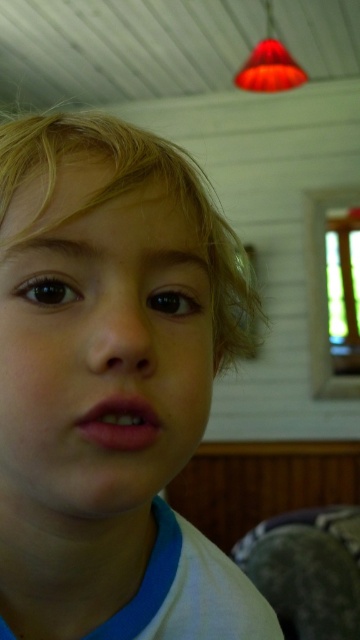
Question: From the image, what is the correct spatial relationship of smooth skin face at center in relation to blonde silky hair at center?

Choices:
 (A) below
 (B) above

Answer: (A)

Question: Does smooth skin face at center have a smaller size compared to blonde silky hair at center?

Choices:
 (A) yes
 (B) no

Answer: (A)

Question: Which of the following is the farthest from the observer?

Choices:
 (A) smooth skin face at center
 (B) blonde silky hair at center

Answer: (B)

Question: Which object appears closest to the camera in this image?

Choices:
 (A) blonde silky hair at center
 (B) smooth skin face at center

Answer: (B)

Question: Is smooth skin face at center positioned before blonde silky hair at center?

Choices:
 (A) yes
 (B) no

Answer: (A)

Question: Which of the following is the closest to the observer?

Choices:
 (A) (120, 280)
 (B) (83, 204)

Answer: (B)